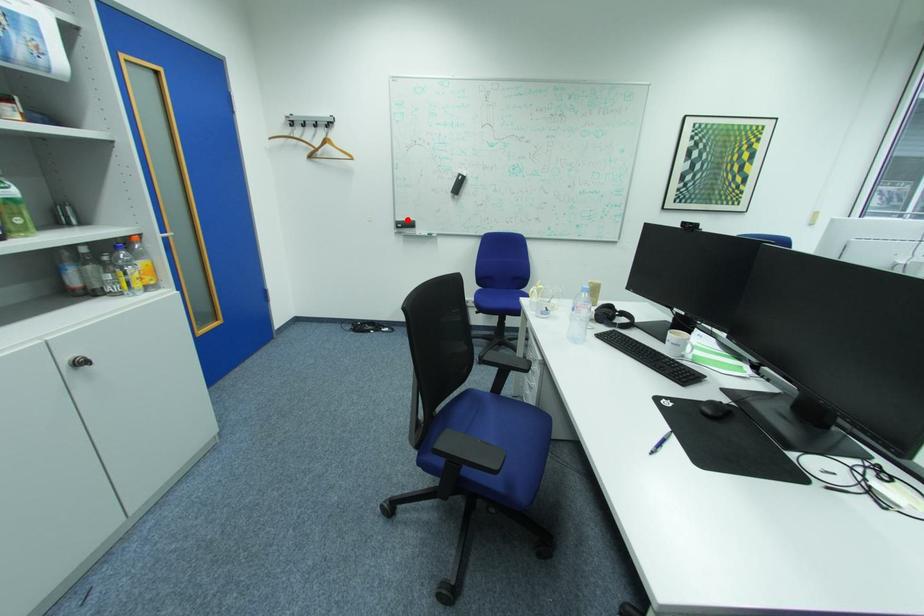
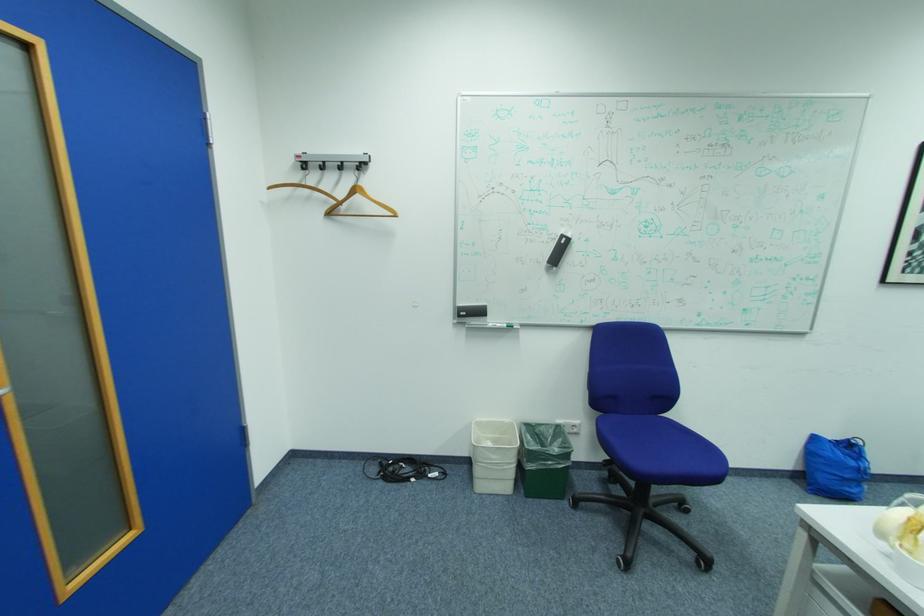
Question: I am providing you with two images of the same scene from different viewpoints. In image1, a red point is highlighted. Considering the same 3D point in image2, which of the following is correct?

Choices:
 (A) It is closer
 (B) It is farther

Answer: (B)